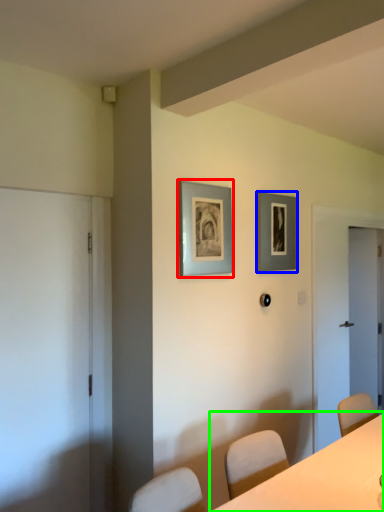
Question: Considering the real-world distances, which object is closest to picture frame (highlighted by a red box)? picture frame (highlighted by a blue box) or table (highlighted by a green box).

Choices:
 (A) picture frame
 (B) table

Answer: (A)